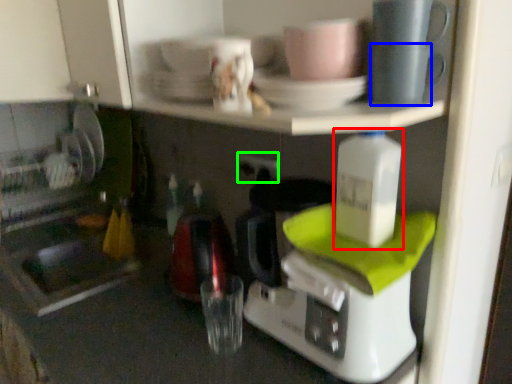
Question: Based on their relative distances, which object is nearer to bottle (highlighted by a red box)? Choose from tableware (highlighted by a blue box) and electric outlet (highlighted by a green box).

Choices:
 (A) tableware
 (B) electric outlet

Answer: (A)